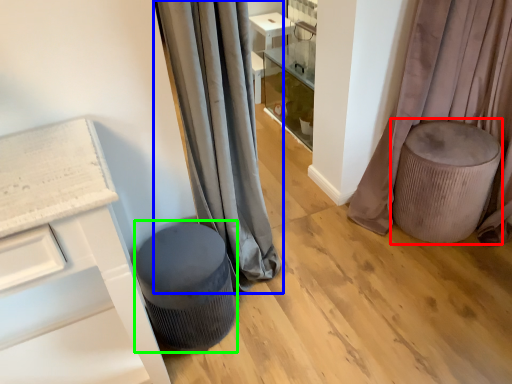
Question: Which object is positioned farthest from swivel chair (highlighted by a red box)? Select from curtain (highlighted by a blue box) and music stool (highlighted by a green box).

Choices:
 (A) curtain
 (B) music stool

Answer: (B)